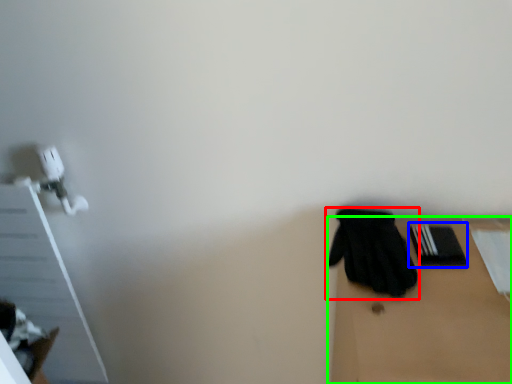
Question: Based on their relative distances, which object is nearer to glove (highlighted by a red box)? Choose from bin (highlighted by a blue box) and table (highlighted by a green box).

Choices:
 (A) bin
 (B) table

Answer: (B)